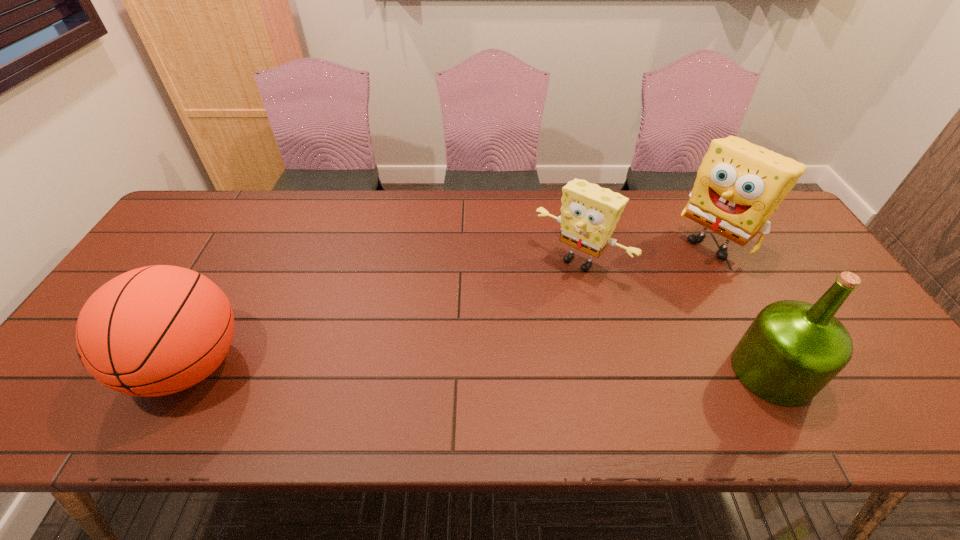
I want to click on object at the far right corner, so click(739, 185).

At what (x,y) coordinates should I click in order to perform the action: click on free region at the far edge of the desktop. Please return your answer as a coordinate pair (x, y). Looking at the image, I should click on (449, 206).

Find the location of a particular element. The image size is (960, 540). free space at the near edge is located at coordinates (441, 370).

Where is `vacant space at the far left corner of the desktop`? This screenshot has height=540, width=960. vacant space at the far left corner of the desktop is located at coordinates (213, 230).

You are a GUI agent. You are given a task and a screenshot of the screen. Output one action in this format:
    pyautogui.click(x=<x>, y=<y>)
    Task: Click on the blank space at the near right corner of the desktop
    Image resolution: width=960 pixels, height=540 pixels.
    Given the screenshot: What is the action you would take?
    pyautogui.click(x=873, y=365)

Find the location of a particular element. free space between the basketball and the olive oil is located at coordinates (481, 369).

Locate an element on the screen. This screenshot has width=960, height=540. free area in between the left sponge and the basketball is located at coordinates [385, 313].

This screenshot has height=540, width=960. Identify the location of free space between the olive oil and the leftmost object. [481, 369].

Where is `vacant space in between the taller sponge and the left sponge`? vacant space in between the taller sponge and the left sponge is located at coordinates (647, 251).

Locate an element on the screen. This screenshot has height=540, width=960. empty location between the shorter sponge and the leftmost object is located at coordinates (385, 313).